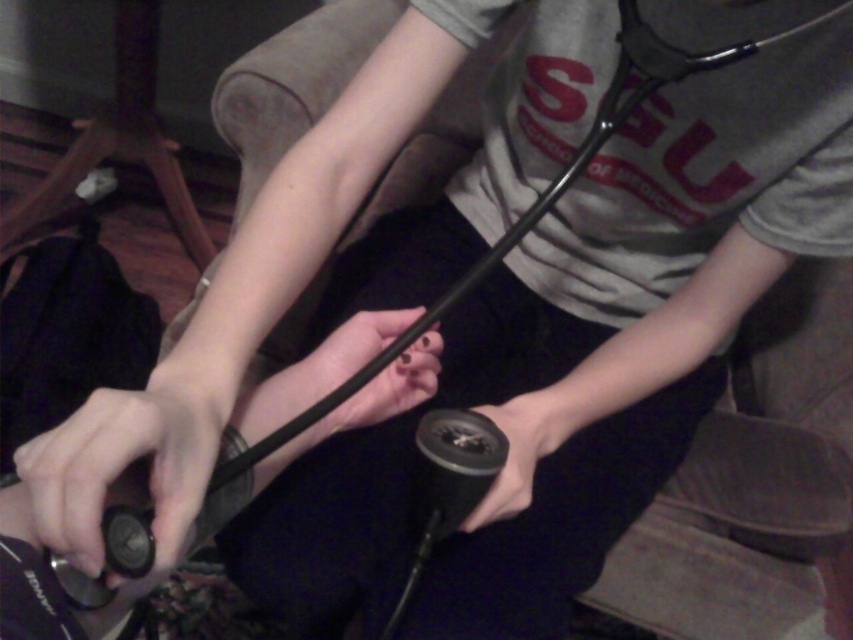
You are a medical student observing the scene. You notice the matte black wristwatch at lower left and the black matte cable at center. Which object is shorter in height?

The matte black wristwatch at lower left has a lesser height compared to the black matte cable at center, so the matte black wristwatch at lower left is shorter in height.

You are a medical student observing the scene. You notice the matte black wristwatch at lower left and the black rubber grip at center. Which object is closer to the viewer?

The matte black wristwatch at lower left is positioned over the black rubber grip at center, so it is closer to the viewer.

You are a medical student who needs to assemble a stethoscope. You have two parts in front of you. The black matte cable at center and the black rubber grip at center. Which part should you choose to hold if you want to grasp the larger component?

The black matte cable at center is larger in size than the black rubber grip at center, so you should choose to hold the black matte cable at center.